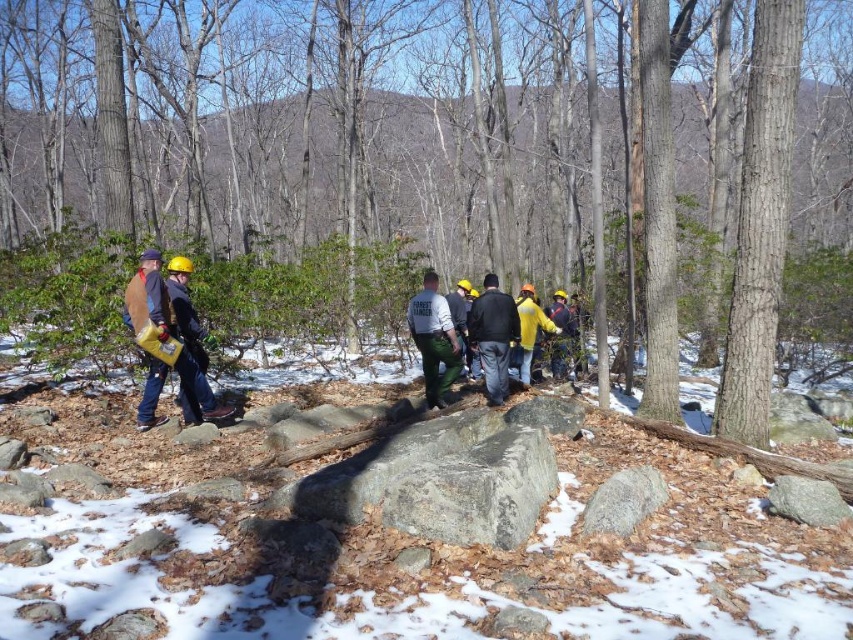
Is matte yellow hard hat at left below matte green uniform at center?

No, matte yellow hard hat at left is not below matte green uniform at center.

Who is positioned more to the right, matte yellow hard hat at left or matte green uniform at center?

Positioned to the right is matte green uniform at center.

What do you see at coordinates (161, 342) in the screenshot? The height and width of the screenshot is (640, 853). I see `matte yellow hard hat at left` at bounding box center [161, 342].

Identify the location of matte yellow hard hat at left. The height and width of the screenshot is (640, 853). click(161, 342).

The height and width of the screenshot is (640, 853). What do you see at coordinates (494, 336) in the screenshot?
I see `green uniform at center` at bounding box center [494, 336].

Does green uniform at center appear on the right side of hard hat construction worker at left?

Correct, you'll find green uniform at center to the right of hard hat construction worker at left.

At what (x,y) coordinates should I click in order to perform the action: click on green uniform at center. Please return your answer as a coordinate pair (x, y). The image size is (853, 640). Looking at the image, I should click on (494, 336).

Locate an element on the screen. green uniform at center is located at coordinates (494, 336).

Does brown bark tree at center appear on the left side of white powdery snow at center?

Incorrect, brown bark tree at center is not on the left side of white powdery snow at center.

What do you see at coordinates (432, 182) in the screenshot? I see `brown bark tree at center` at bounding box center [432, 182].

You are a GUI agent. You are given a task and a screenshot of the screen. Output one action in this format:
    pyautogui.click(x=<x>, y=<y>)
    Task: Click on the brown bark tree at center
    This screenshot has width=853, height=640.
    Given the screenshot: What is the action you would take?
    pyautogui.click(x=432, y=182)